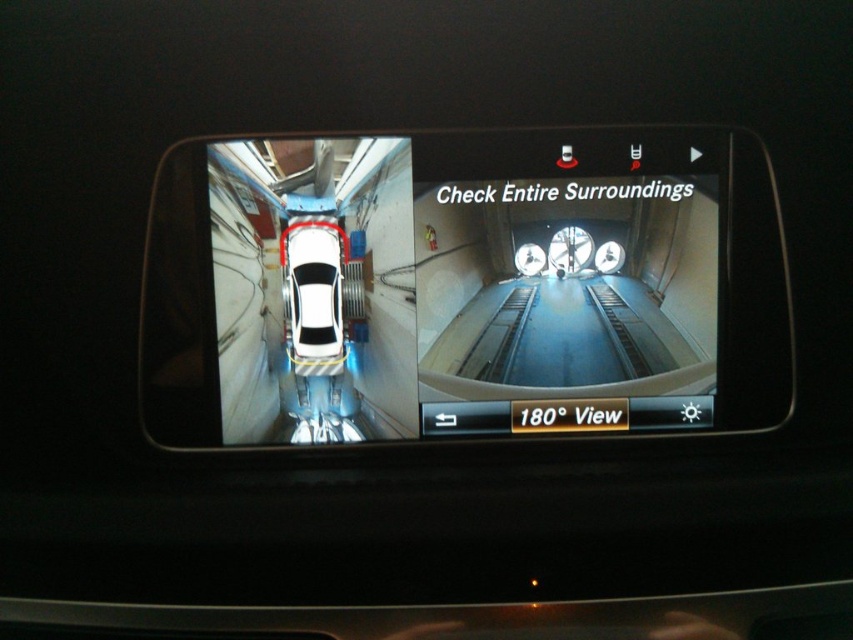
You are driving a car and want to check the rearview mirror. Based on the image, which object, the transparent glass rearview mirror at center or the white matte car at center, would you see more of in your actual rearview mirror?

The transparent glass rearview mirror at center has a larger size compared to the white matte car at center, so you would see more of the transparent glass rearview mirror at center in your actual rearview mirror.